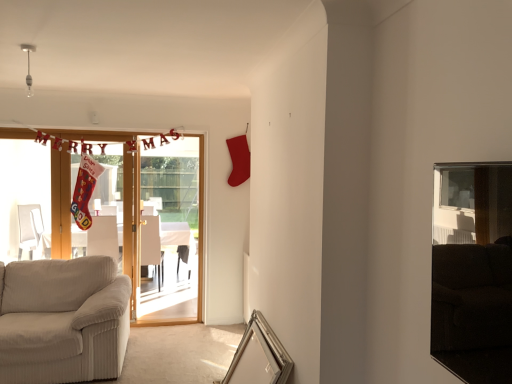
Question: Considering their positions, is metallic silver picture frame at lower center located in front of or behind wooden door at left?

Choices:
 (A) front
 (B) behind

Answer: (A)

Question: From the image's perspective, is metallic silver picture frame at lower center positioned above or below wooden door at left?

Choices:
 (A) above
 (B) below

Answer: (B)

Question: Based on their relative distances, which object is nearer to the white fabric armchair at center, positioned as the first armchair in right-to-left order?

Choices:
 (A) white fabric armchair at left, marked as the 2th armchair in a right-to-left arrangement
 (B) wooden door at left
 (C) beige fabric couch at lower left
 (D) metallic silver picture frame at lower center

Answer: (B)

Question: Estimate the real-world distances between objects in this image. Which object is closer to the white fabric armchair at left, marked as the 2th armchair in a right-to-left arrangement?

Choices:
 (A) white fabric armchair at center, positioned as the first armchair in right-to-left order
 (B) metallic silver picture frame at lower center
 (C) wooden door at left
 (D) beige fabric couch at lower left

Answer: (A)